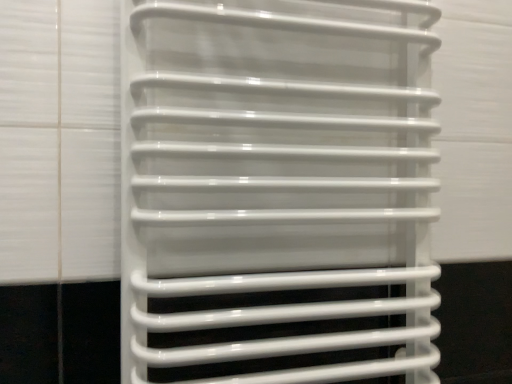
The height and width of the screenshot is (384, 512). Describe the element at coordinates (278, 192) in the screenshot. I see `white glossy towel rack at center` at that location.

Find the location of a particular element. The image size is (512, 384). white glossy towel rack at center is located at coordinates (278, 192).

This screenshot has width=512, height=384. What are the coordinates of `white glossy towel rack at center` in the screenshot? It's located at (278, 192).